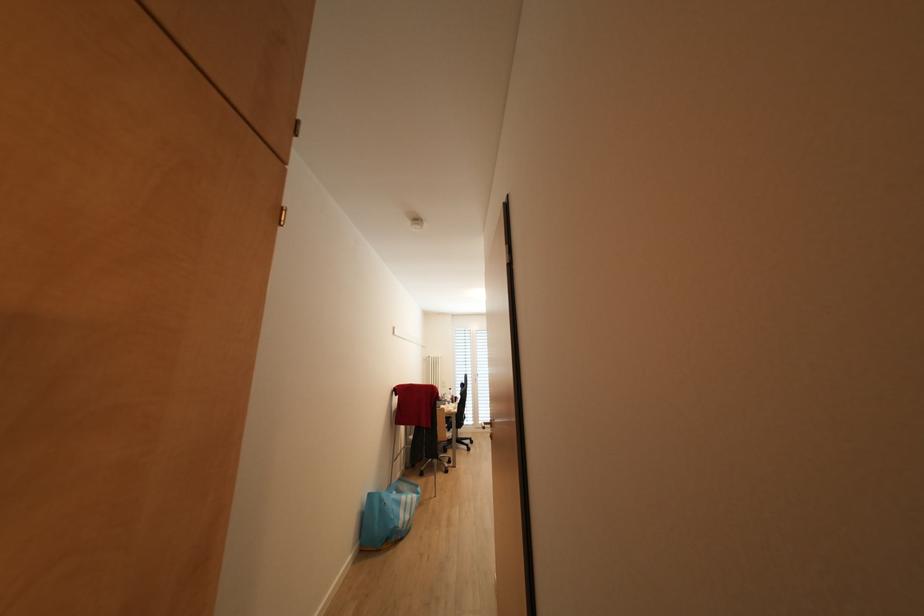
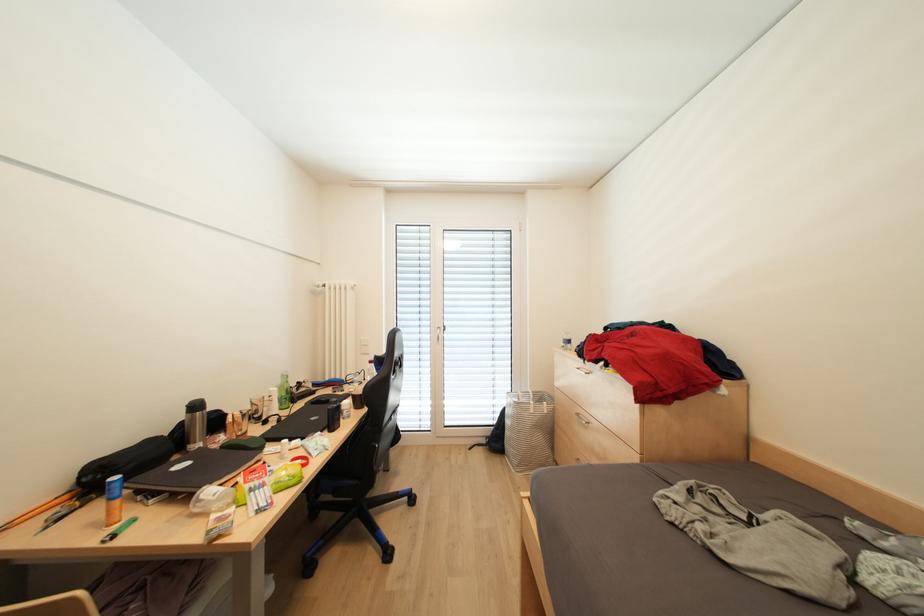
Question: Which direction would the cameraman need to move to produce the second image? Reply with the corresponding letter.

Choices:
 (A) Left
 (B) Right
 (C) Forward
 (D) Backward

Answer: (C)